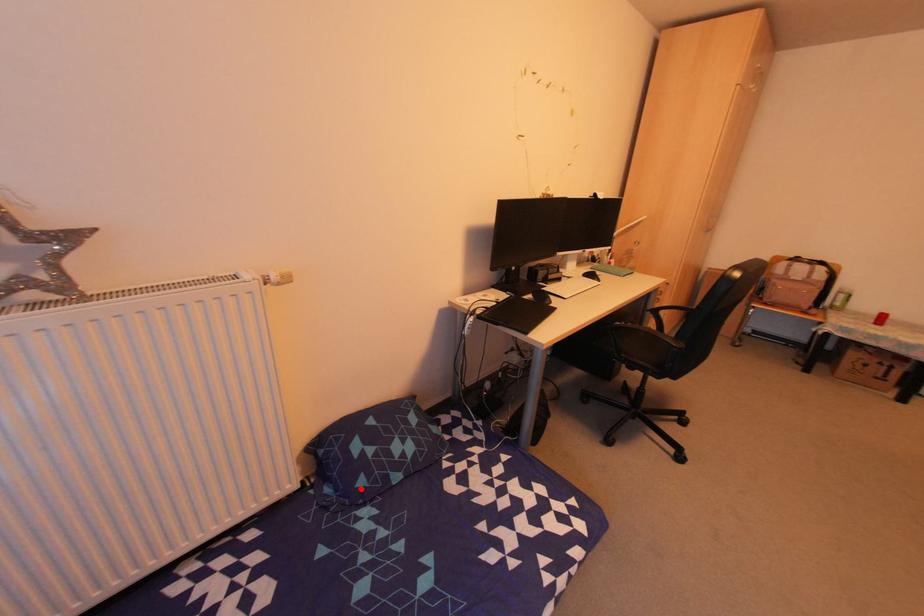
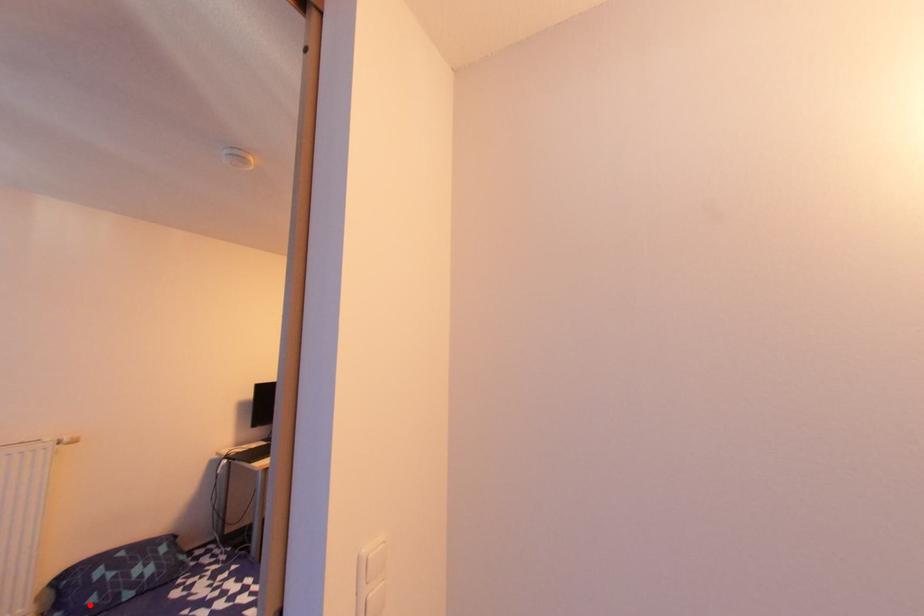
I am providing you with two images of the same scene from different viewpoints. A red point is marked on the first image and another point is marked on the second image. Are the points marked in image1 and image2 representing the same 3D position?

Yes